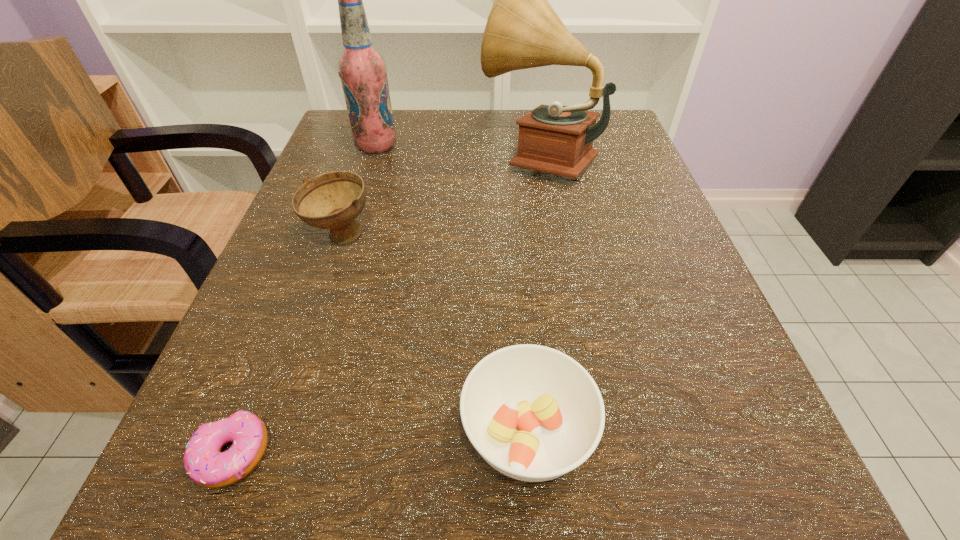
Identify the location of vacant region located on the right of the alcohol. This screenshot has width=960, height=540. (x=565, y=146).

The height and width of the screenshot is (540, 960). What are the coordinates of `free space located on the back of the taller soup bowl` in the screenshot? It's located at (379, 124).

The width and height of the screenshot is (960, 540). Identify the location of vacant region located 0.200m on the left of the shorter soup bowl. (281, 435).

Where is `vacant region located on the right of the shortest object`? vacant region located on the right of the shortest object is located at coordinates (382, 454).

Image resolution: width=960 pixels, height=540 pixels. In order to click on phonograph record that is at the far edge in this screenshot , I will do `click(523, 31)`.

The width and height of the screenshot is (960, 540). Identify the location of alcohol that is at the far edge. (362, 69).

Identify the location of soup bowl located in the near edge section of the desktop. (533, 413).

Identify the location of doughnut located in the near edge section of the desktop. This screenshot has height=540, width=960. (205, 464).

I want to click on alcohol that is at the left edge, so click(x=362, y=69).

At what (x,y) coordinates should I click in order to perform the action: click on soup bowl that is at the left edge. Please return your answer as a coordinate pair (x, y). Image resolution: width=960 pixels, height=540 pixels. Looking at the image, I should click on (333, 200).